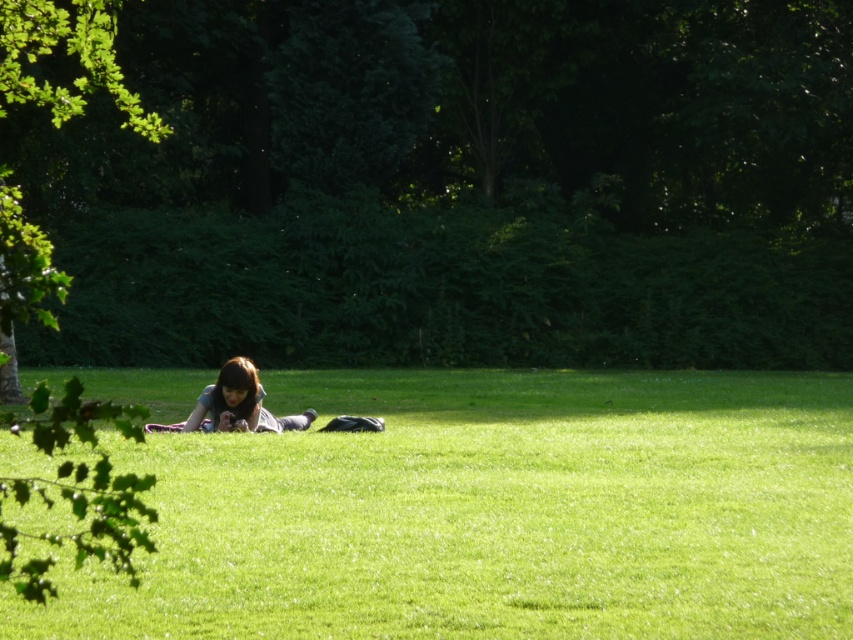
Question: Which object appears farthest from the camera in this image?

Choices:
 (A) dark brown hair at center
 (B) green grass at center

Answer: (A)

Question: Does green grass at center appear on the left side of dark brown hair at center?

Choices:
 (A) yes
 (B) no

Answer: (B)

Question: Which point is closer to the camera?

Choices:
 (A) (260, 413)
 (B) (112, 454)

Answer: (B)

Question: Is green grass at center closer to the viewer compared to dark brown hair at center?

Choices:
 (A) yes
 (B) no

Answer: (A)

Question: Is green grass at center bigger than dark brown hair at center?

Choices:
 (A) no
 (B) yes

Answer: (B)